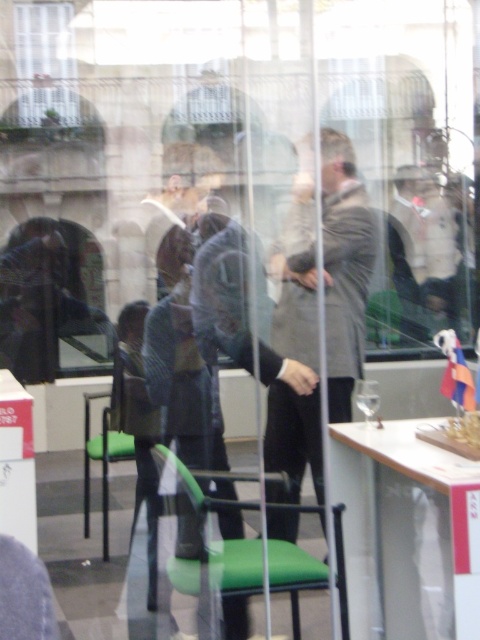
Is gray wool coat at center bigger than green plastic chair at center?

Correct, gray wool coat at center is larger in size than green plastic chair at center.

What are the coordinates of `gray wool coat at center` in the screenshot? It's located at (344, 268).

In order to click on gray wool coat at center in this screenshot , I will do `click(344, 268)`.

Does gray wool coat at center have a smaller size compared to green fabric chair at lower left?

Correct, gray wool coat at center occupies less space than green fabric chair at lower left.

Can you confirm if gray wool coat at center is wider than green fabric chair at lower left?

In fact, gray wool coat at center might be narrower than green fabric chair at lower left.

Measure the distance between gray wool coat at center and camera.

9.33 feet

You are a GUI agent. You are given a task and a screenshot of the screen. Output one action in this format:
    pyautogui.click(x=<x>, y=<y>)
    Task: Click on the gray wool coat at center
    
    Given the screenshot: What is the action you would take?
    pyautogui.click(x=344, y=268)

Which is behind, point (385, 420) or point (189, 584)?

Positioned behind is point (385, 420).

Is wooden table at center positioned behind green plastic chair at center?

No, wooden table at center is in front of green plastic chair at center.

The image size is (480, 640). Identify the location of wooden table at center. (400, 525).

At what (x,y) coordinates should I click in order to perform the action: click on wooden table at center. Please return your answer as a coordinate pair (x, y). This screenshot has height=640, width=480. Looking at the image, I should click on (400, 525).